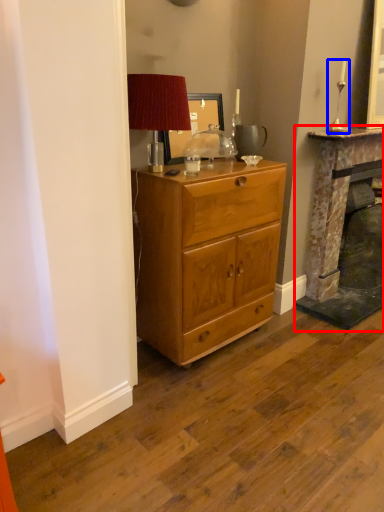
Question: Which object is further to the camera taking this photo, fireplace (highlighted by a red box) or candle holder (highlighted by a blue box)?

Choices:
 (A) fireplace
 (B) candle holder

Answer: (A)